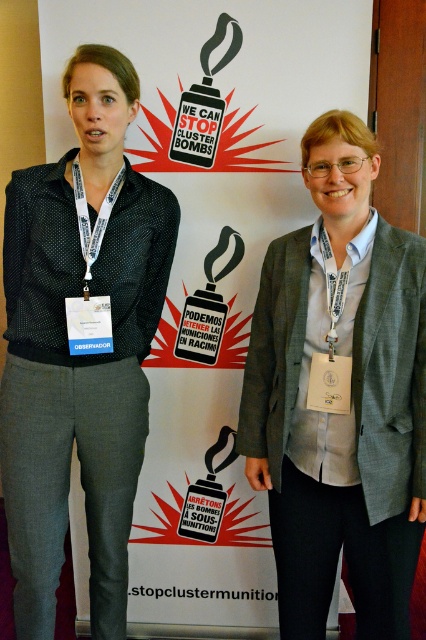
Question: Among these objects, which one is farthest from the camera?

Choices:
 (A) gray textured blazer at center
 (B) black dotted shirt at left

Answer: (B)

Question: Is gray textured blazer at center below black dotted shirt at left?

Choices:
 (A) yes
 (B) no

Answer: (A)

Question: Does gray textured blazer at center have a larger size compared to black dotted shirt at left?

Choices:
 (A) yes
 (B) no

Answer: (B)

Question: Is gray textured blazer at center to the left of black dotted shirt at left from the viewer's perspective?

Choices:
 (A) no
 (B) yes

Answer: (A)